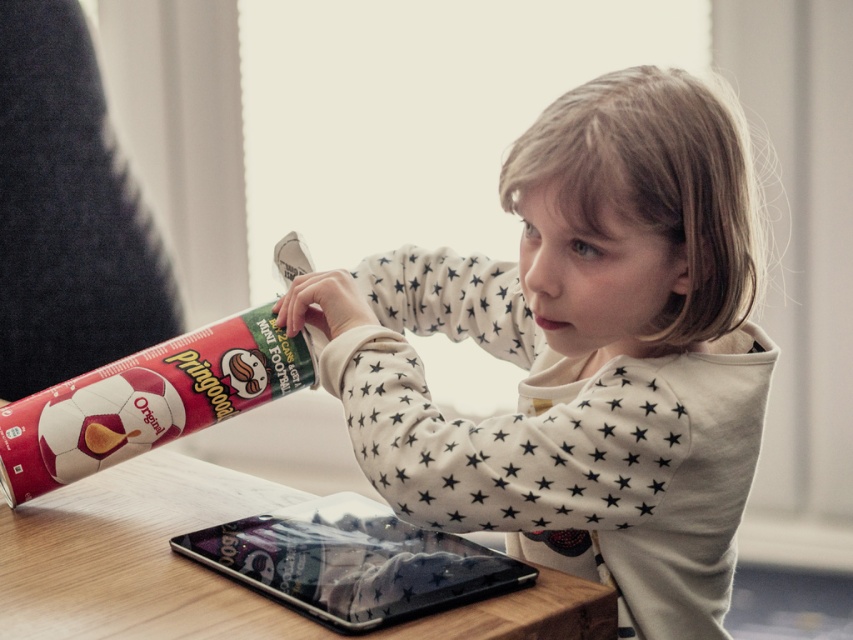
You are a photographer taking a picture of the scene. You notice two points on the tablet screen at coordinates point (x=219, y=513) and point (x=467, y=541). Which point is closer to the camera?

Point (x=219, y=513) is further to the camera than point (x=467, y=541), so point (x=219, y=513) is closer to the camera.

You are a photographer trying to capture the child and the snack tube. You notice two points on the table surface at coordinates point (647, 404) and point (239, 579). Which point is closer to the camera?

Point (647, 404) is further to the camera than point (239, 579), so the closer point to the camera is point (239, 579).